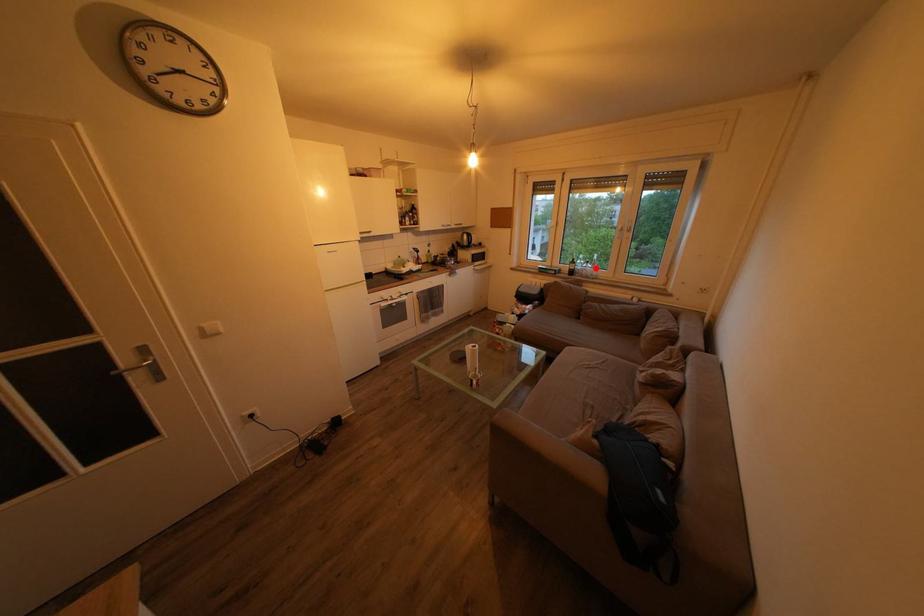
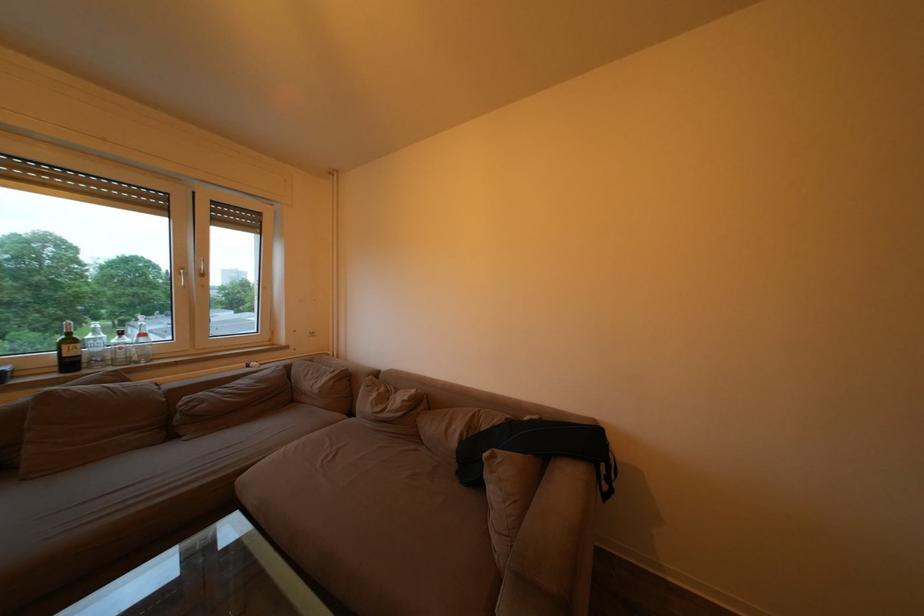
Question: A red point is marked in image1. In image2, is the corresponding 3D point closer to the camera or farther? Reply with the corresponding letter.

Choices:
 (A) The corresponding 3D point is closer.
 (B) The corresponding 3D point is farther.

Answer: (B)